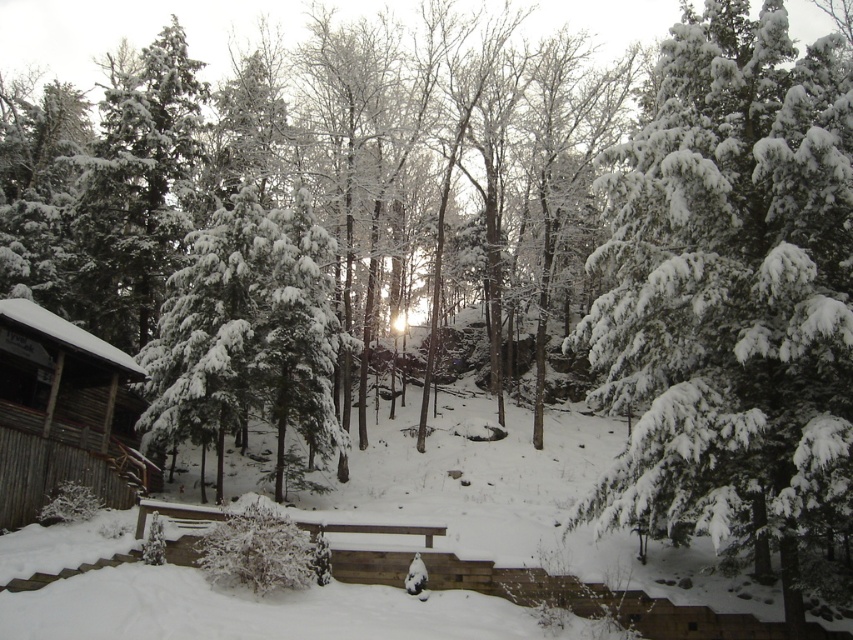
Consider the image. You are standing at the point labeled point [28,305] and want to walk to the cabin or shed on the left. Is the point labeled point [833,419] blocking your path?

Point [833,419] is in front of point [28,305], so it is blocking your path to the cabin or shed on the left.